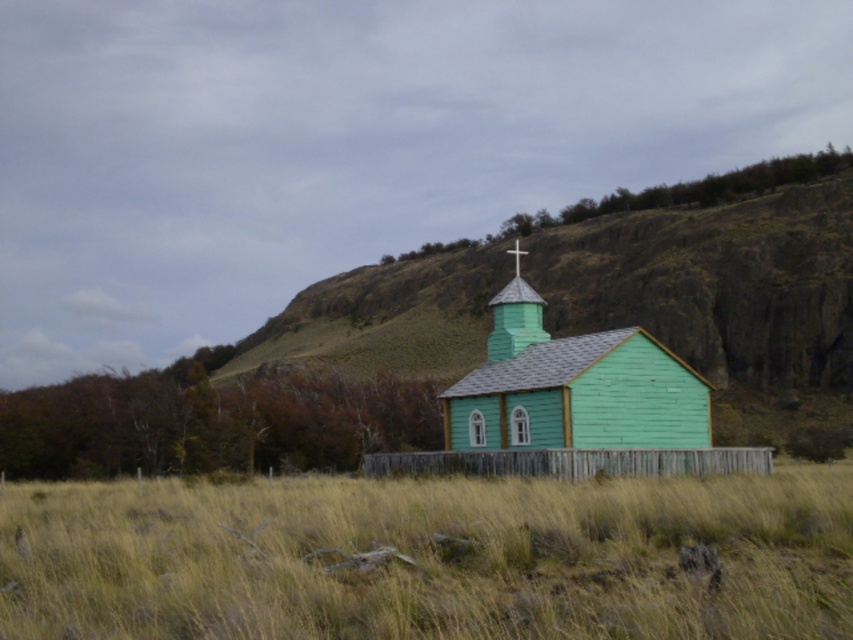
You are standing in the middle of the green grass at center and want to walk towards the green wooden church at center. Which direction should you move to reach it?

Since the green grass at center is positioned on the left side of the green wooden church at center, you should move to the right to reach the green wooden church at center.

You are a gardener planning to mow the green grass at center and the green wooden church at center. Which area requires more time to mow?

The green grass at center is bigger than the green wooden church at center, so it would require more time to mow the green grass at center.